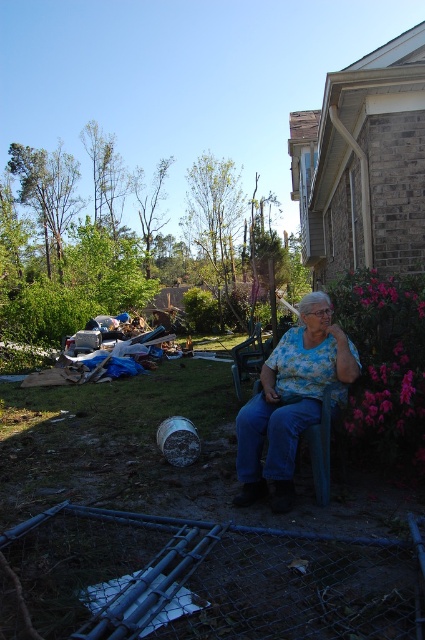
Describe the element at coordinates (291, 401) in the screenshot. I see `floral print blouse at center` at that location.

Between point (260, 481) and point (249, 340), which one is positioned in front?

Positioned in front is point (260, 481).

Find the location of a particular element. Image resolution: width=425 pixels, height=640 pixels. floral print blouse at center is located at coordinates (291, 401).